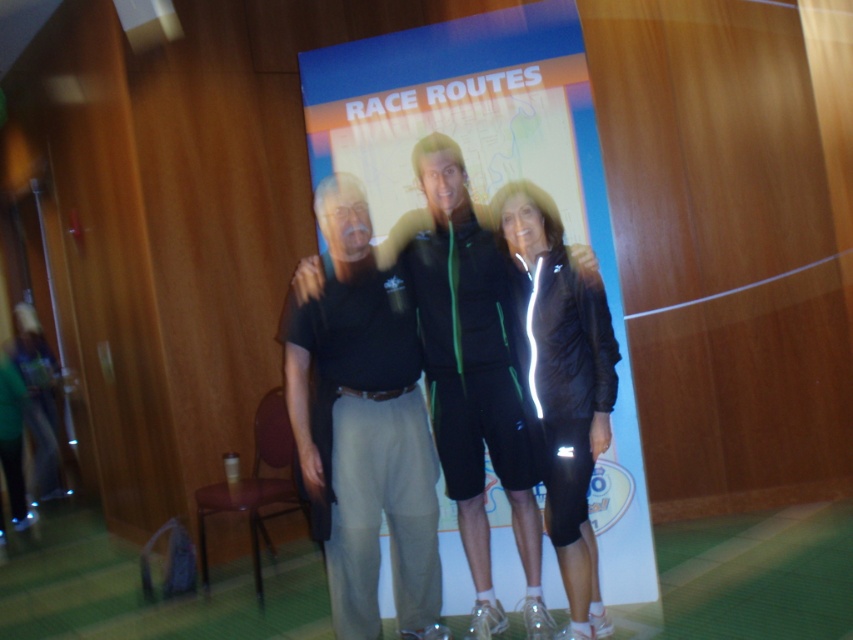
You are standing at point (450,268) and want to take a photo of the promotional poster. The camera is 9.60 feet away from you. Is the camera close enough to capture the entire poster in the frame?

The camera is 9.60 feet away from point (450,268), so it is close enough to capture the entire poster in the frame.

You are trying to locate the black cotton shirt at center in the photo. According to the coordinates provided, where exactly is it positioned?

The black cotton shirt at center is located at point 0.666 on the x axis and 0.426 on the y axis.